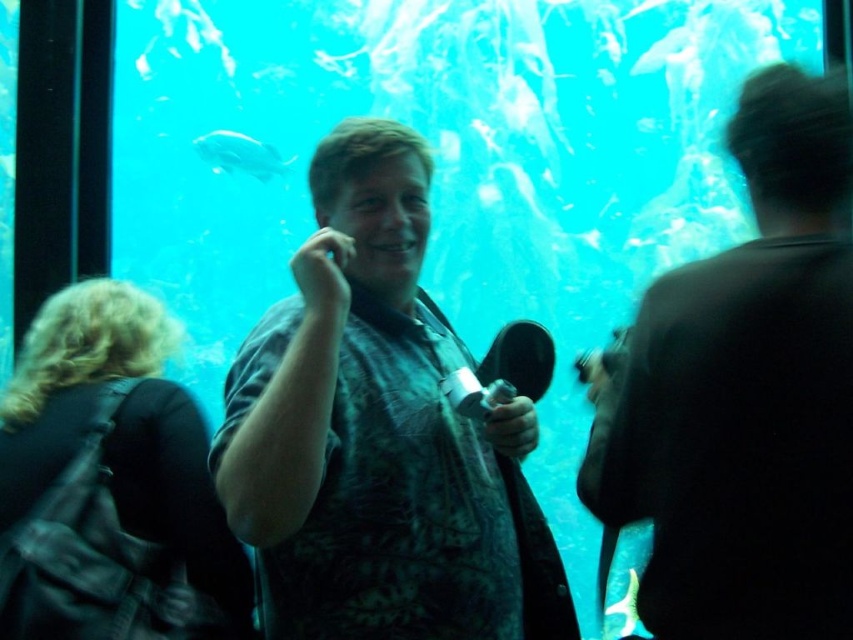
What object is located at the coordinates point (x=378, y=435) in the image?

The point (x=378, y=435) indicates the textured gray shirt at center.